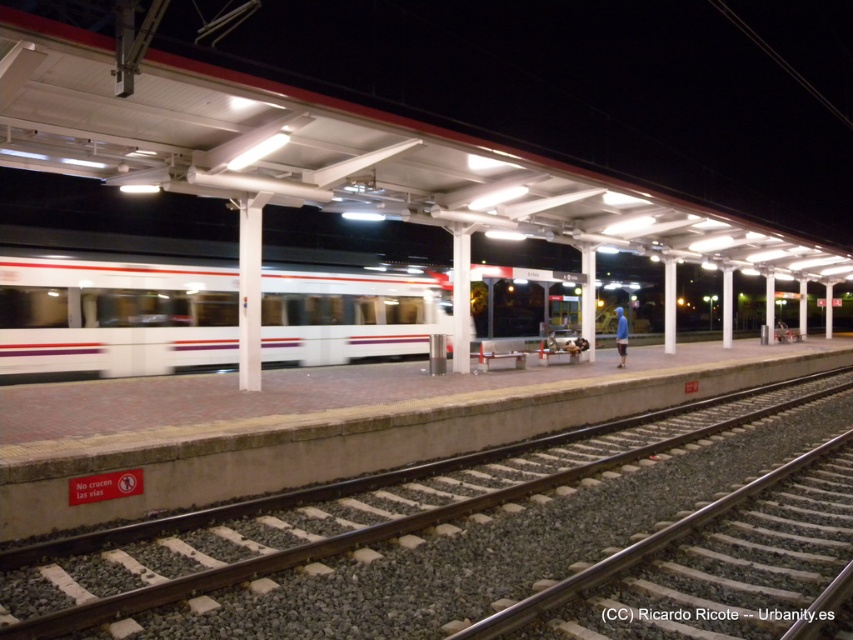
Question: Which point appears closest to the camera in this image?

Choices:
 (A) (552, 445)
 (B) (235, 348)

Answer: (A)

Question: From the image, what is the correct spatial relationship of brown gravel track at lower center in relation to smooth steel tracks at center?

Choices:
 (A) left
 (B) right

Answer: (B)

Question: Is brown gravel track at lower center smaller than smooth steel tracks at center?

Choices:
 (A) yes
 (B) no

Answer: (B)

Question: Which point is farther to the camera?

Choices:
 (A) (38, 284)
 (B) (784, 497)

Answer: (A)

Question: Is brown gravel track at lower center behind white glossy train at center?

Choices:
 (A) no
 (B) yes

Answer: (A)

Question: Which of the following is the closest to the observer?

Choices:
 (A) (28, 545)
 (B) (265, 310)
 (C) (756, 628)

Answer: (C)